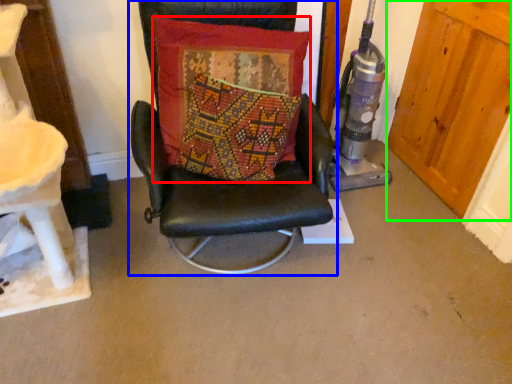
Question: Which is nearer to the pillow (highlighted by a red box)? chair (highlighted by a blue box) or door (highlighted by a green box).

Choices:
 (A) chair
 (B) door

Answer: (A)